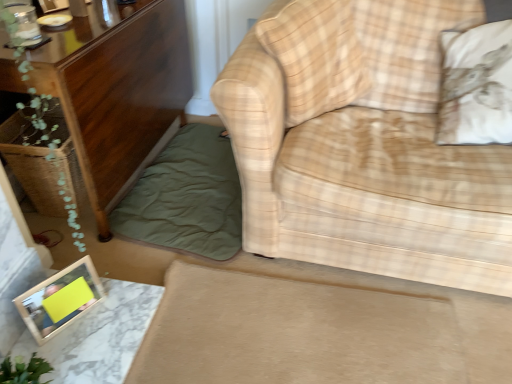
Question: From a real-world perspective, does wooden cabinet at left stand above white cotton pillow at upper right, which is counted as the first pillow, starting from the right?

Choices:
 (A) yes
 (B) no

Answer: (B)

Question: Are wooden cabinet at left and white cotton pillow at upper right, arranged as the second pillow when viewed from the left, making contact?

Choices:
 (A) yes
 (B) no

Answer: (B)

Question: Is wooden cabinet at left at the right side of white cotton pillow at upper right, which is counted as the first pillow, starting from the right?

Choices:
 (A) yes
 (B) no

Answer: (B)

Question: Considering the relative sizes of wooden cabinet at left and white cotton pillow at upper right, arranged as the second pillow when viewed from the left, in the image provided, is wooden cabinet at left bigger than white cotton pillow at upper right, arranged as the second pillow when viewed from the left,?

Choices:
 (A) yes
 (B) no

Answer: (A)

Question: Is the position of wooden cabinet at left more distant than that of white cotton pillow at upper right, which is counted as the first pillow, starting from the right?

Choices:
 (A) yes
 (B) no

Answer: (A)

Question: Would you say wooden cabinet at left contains white cotton pillow at upper right, which is counted as the first pillow, starting from the right?

Choices:
 (A) no
 (B) yes

Answer: (A)

Question: Is wooden cabinet at left behind green leafy plant at left?

Choices:
 (A) no
 (B) yes

Answer: (B)

Question: Can you confirm if wooden cabinet at left is taller than green leafy plant at left?

Choices:
 (A) yes
 (B) no

Answer: (B)

Question: Is green leafy plant at left located within wooden cabinet at left?

Choices:
 (A) no
 (B) yes

Answer: (A)

Question: Does wooden cabinet at left have a lesser height compared to green leafy plant at left?

Choices:
 (A) no
 (B) yes

Answer: (B)

Question: Does wooden cabinet at left come in front of green leafy plant at left?

Choices:
 (A) yes
 (B) no

Answer: (B)

Question: Is wooden cabinet at left next to green leafy plant at left?

Choices:
 (A) no
 (B) yes

Answer: (A)

Question: Are green cotton blanket at lower left and plaid fabric pillow at center, the second pillow in the right-to-left sequence, located far from each other?

Choices:
 (A) no
 (B) yes

Answer: (A)